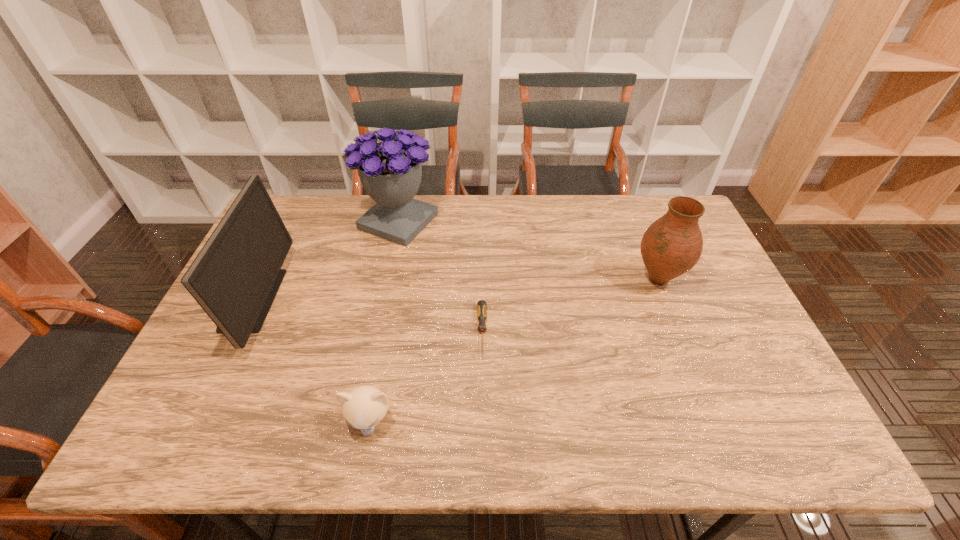
Find the location of a particular element. free space located 0.070m insert the shortest object into a screw head is located at coordinates (482, 384).

The width and height of the screenshot is (960, 540). Find the location of `object that is at the far edge`. object that is at the far edge is located at coordinates (390, 171).

Find the location of a particular element. Image resolution: width=960 pixels, height=540 pixels. object at the near edge is located at coordinates (364, 407).

The width and height of the screenshot is (960, 540). Identify the location of object located in the left edge section of the desktop. (235, 277).

Where is `object located in the right edge section of the desktop`? This screenshot has width=960, height=540. object located in the right edge section of the desktop is located at coordinates (672, 245).

You are a GUI agent. You are given a task and a screenshot of the screen. Output one action in this format:
    pyautogui.click(x=<x>, y=<y>)
    Task: Click on the blank area at the far edge
    
    Given the screenshot: What is the action you would take?
    pyautogui.click(x=570, y=223)

At what (x,y) coordinates should I click in order to perform the action: click on free space at the near edge of the desktop. Please return your answer as a coordinate pair (x, y). The height and width of the screenshot is (540, 960). Looking at the image, I should click on (395, 417).

The height and width of the screenshot is (540, 960). What are the coordinates of `blank area at the left edge` in the screenshot? It's located at (260, 350).

Find the location of a particular element. Image resolution: width=960 pixels, height=540 pixels. vacant space at the right edge of the desktop is located at coordinates (705, 251).

Where is `vacant space at the far right corner of the desktop`? The width and height of the screenshot is (960, 540). vacant space at the far right corner of the desktop is located at coordinates (650, 204).